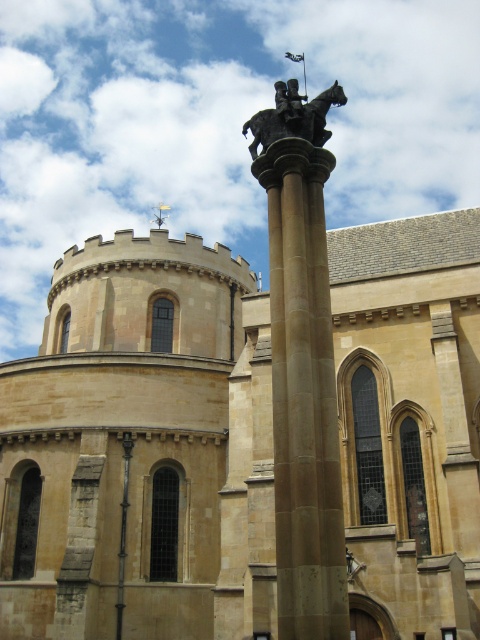
You are an architect assessing the historic site. You need to determine which structure is taller between the beige stone church at center and the beige stone column at center. Based on the scene, which one is taller?

The beige stone church at center is much taller than the beige stone column at center according to the description.

Based on the scene description, where is the beige stone church at center located in terms of coordinates?

The beige stone church at center is located at coordinates point (141, 449).

You are standing in front of a historic site and want to take a photo of the beige stone column at center. If your camera has a maximum focus range of 20 meters, will it be able to capture the column clearly?

The beige stone column at center is 21.16 meters away from the camera. Since this distance exceeds the camera maximum focus range of 20 meters, the camera will not be able to capture the column clearly.